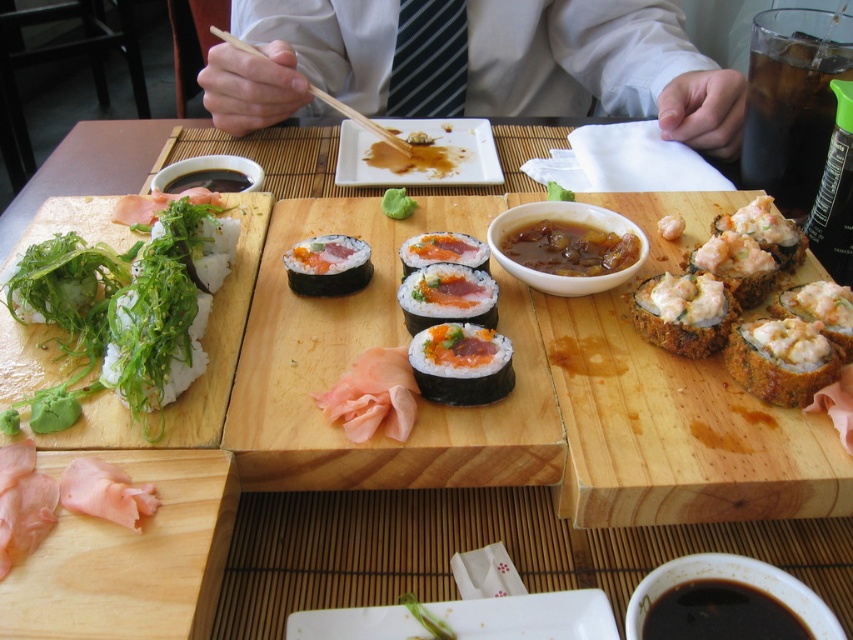
Question: Is pink wood cutting board at lower left positioned at the back of shiny pinkish shrimp tempura at right?

Choices:
 (A) yes
 (B) no

Answer: (B)

Question: Can you confirm if wooden cutting board at right is bigger than green seaweed at upper left?

Choices:
 (A) no
 (B) yes

Answer: (B)

Question: Which point is farther to the camera?

Choices:
 (A) wooden chopsticks at upper center
 (B) green seaweed rice at left
 (C) green seaweed at upper left
 (D) green seaweed at center

Answer: (A)

Question: Among these points, which one is farthest from the camera?

Choices:
 (A) (361, 257)
 (B) (96, 506)
 (C) (769, 269)

Answer: (A)

Question: Does pink translucent salmon at lower left have a lesser width compared to green seaweed at center?

Choices:
 (A) yes
 (B) no

Answer: (B)

Question: Considering the real-world distances, which object is farthest from the green seaweed at upper left?

Choices:
 (A) green seaweed at center
 (B) golden crispy roll at right
 (C) wooden cutting board at right
 (D) shiny pinkish shrimp tempura at right

Answer: (A)